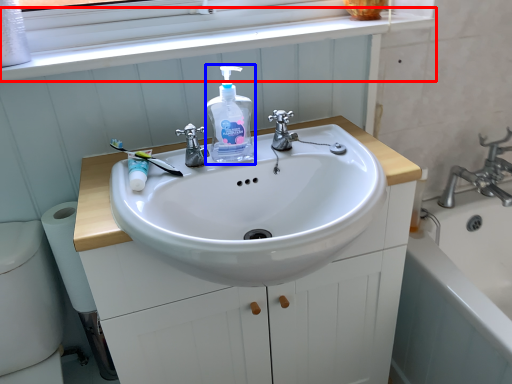
Question: Among these objects, which one is farthest to the camera, window frame (highlighted by a red box) or cleaning product (highlighted by a blue box)?

Choices:
 (A) window frame
 (B) cleaning product

Answer: (A)